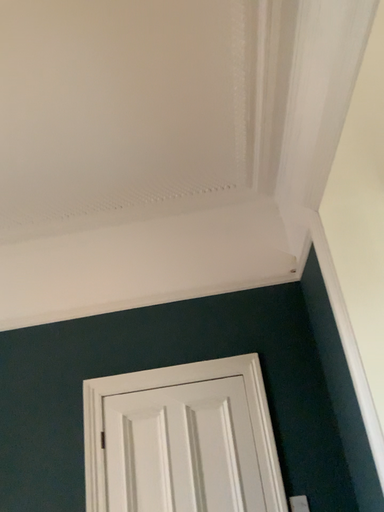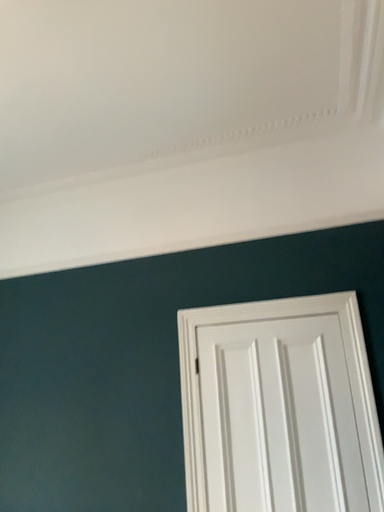
Question: How did the camera likely rotate when shooting the video?

Choices:
 (A) rotated downward
 (B) rotated upward

Answer: (A)